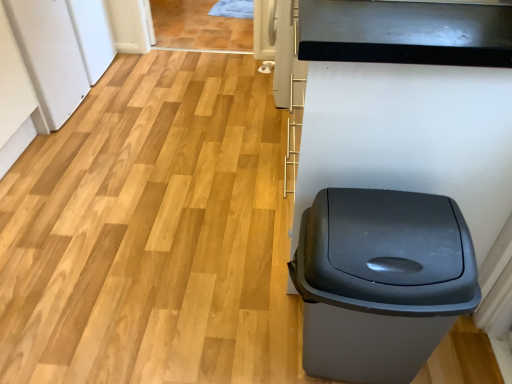
You are a GUI agent. You are given a task and a screenshot of the screen. Output one action in this format:
    pyautogui.click(x=<x>, y=<y>)
    Task: Click on the empty space that is ontop of matte gray plastic trash can at right (from a real-world perspective)
    The height and width of the screenshot is (384, 512).
    Given the screenshot: What is the action you would take?
    pyautogui.click(x=387, y=214)